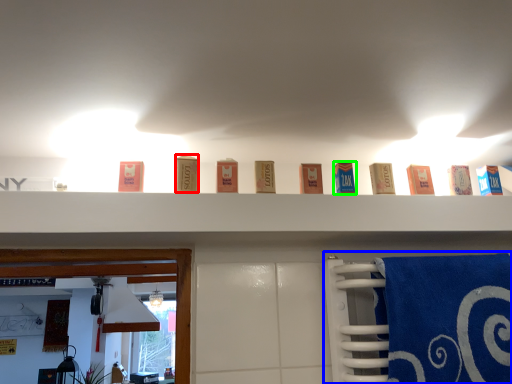
Question: Which is farther away from product (highlighted by a red box)? bath towel (highlighted by a blue box) or product (highlighted by a green box)?

Choices:
 (A) bath towel
 (B) product

Answer: (A)